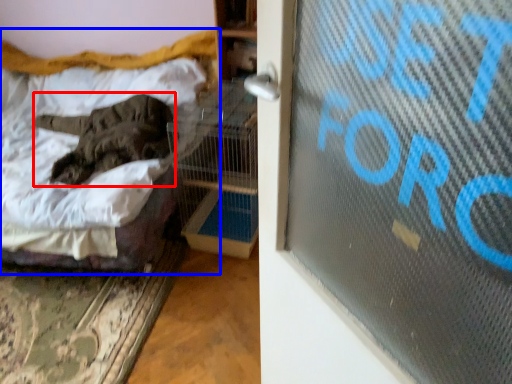
Question: Which point is further to the camera, animal (highlighted by a red box) or bed (highlighted by a blue box)?

Choices:
 (A) animal
 (B) bed

Answer: (A)